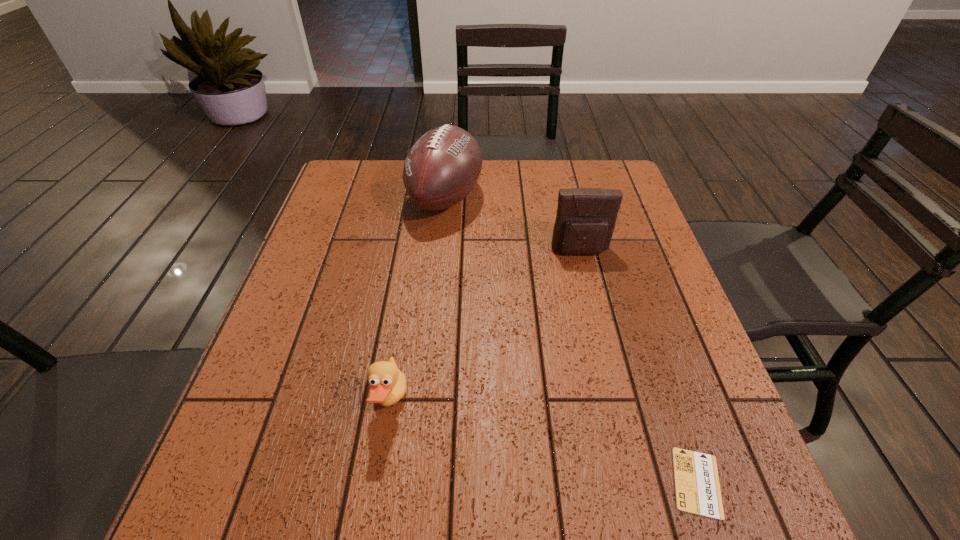
Find the location of a particular element. vacant region that satisfies the following two spatial constraints: 1. with an open flap on the identity card; 2. on the left side of the third nearest object is located at coordinates (636, 482).

This screenshot has width=960, height=540. Identify the location of vacant space that satisfies the following two spatial constraints: 1. on the beak of the nearest object; 2. on the left side of the third tallest object. (377, 482).

Locate an element on the screen. Image resolution: width=960 pixels, height=540 pixels. free location that satisfies the following two spatial constraints: 1. with an open flap on the pouch; 2. on the left side of the shortest object is located at coordinates (636, 482).

This screenshot has height=540, width=960. Find the location of `free space in the image that satisfies the following two spatial constraints: 1. on the beak of the second nearest object; 2. on the left side of the shortest object`. free space in the image that satisfies the following two spatial constraints: 1. on the beak of the second nearest object; 2. on the left side of the shortest object is located at coordinates (377, 482).

Identify the location of vacant area in the image that satisfies the following two spatial constraints: 1. with an open flap on the third shortest object; 2. on the beak of the third farthest object. This screenshot has height=540, width=960. (616, 402).

Identify the location of vacant space that satisfies the following two spatial constraints: 1. on the front side of the football (American); 2. on the beak of the second nearest object. (426, 402).

Locate an element on the screen. blank area in the image that satisfies the following two spatial constraints: 1. with an open flap on the shortest object; 2. on the right side of the pouch is located at coordinates (636, 482).

You are a GUI agent. You are given a task and a screenshot of the screen. Output one action in this format:
    pyautogui.click(x=<x>, y=<y>)
    Task: Click on the vacant space that satisfies the following two spatial constraints: 1. with an open flap on the pouch; 2. on the beak of the second shortest object
    The width and height of the screenshot is (960, 540).
    Given the screenshot: What is the action you would take?
    pyautogui.click(x=616, y=402)